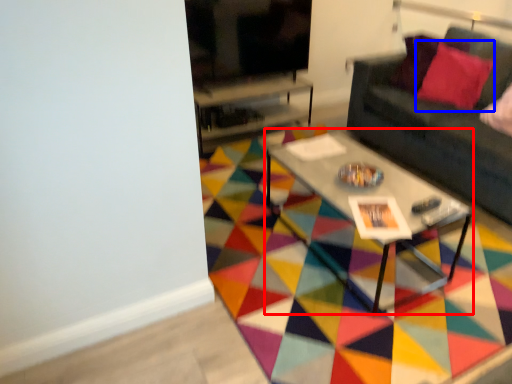
Question: Which object is further to the camera taking this photo, coffee table (highlighted by a red box) or throw pillow (highlighted by a blue box)?

Choices:
 (A) coffee table
 (B) throw pillow

Answer: (B)